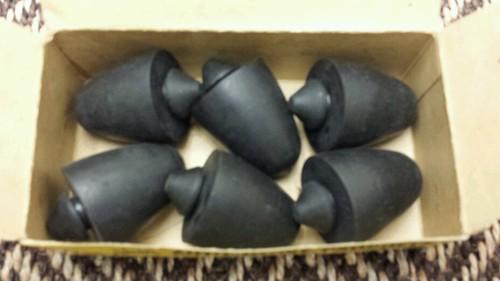
Identify the location of rug. The image size is (500, 281). (250, 273).